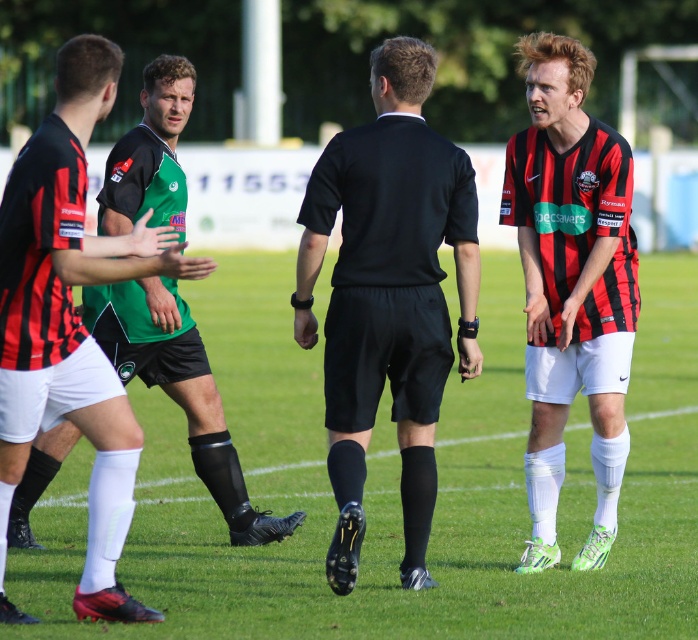
You are a soccer player on the field and notice the black matte referee at center and the black matte shorts at center. Which one is located to the right?

The black matte referee at center is positioned on the right side of black matte shorts at center, so the referee is to the right of the shorts.